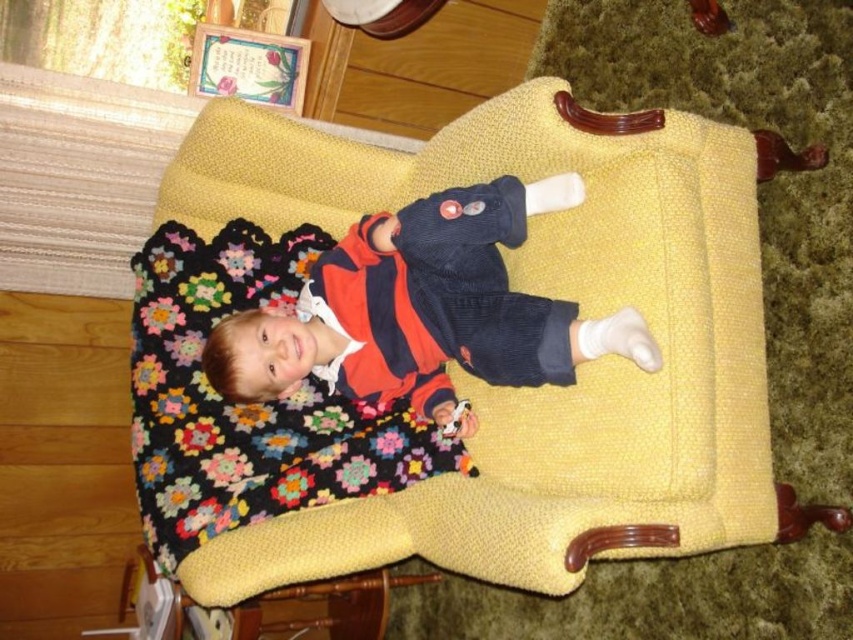
Question: In this image, where is matte corduroy sweater at center located relative to multicolored knitted blanket at center?

Choices:
 (A) right
 (B) left

Answer: (A)

Question: Can you confirm if matte corduroy sweater at center is positioned above multicolored knitted blanket at center?

Choices:
 (A) no
 (B) yes

Answer: (B)

Question: Does matte corduroy sweater at center have a greater width compared to multicolored knitted blanket at center?

Choices:
 (A) no
 (B) yes

Answer: (B)

Question: Which point is closer to the camera?

Choices:
 (A) matte corduroy sweater at center
 (B) multicolored knitted blanket at center

Answer: (A)

Question: Which of the following is the farthest from the observer?

Choices:
 (A) (540, 378)
 (B) (405, 474)

Answer: (B)